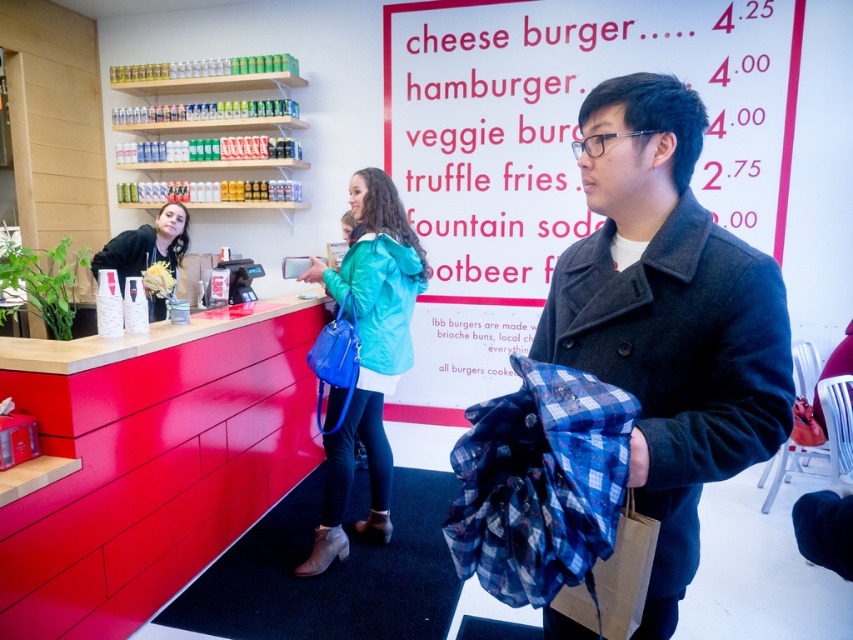
Locate an element on the screen. The image size is (853, 640). dark wool coat at center is located at coordinates (668, 317).

Does dark wool coat at center come in front of teal fabric jacket at center?

Yes, it is in front of teal fabric jacket at center.

Which is behind, point (601, 193) or point (383, 312)?

Positioned behind is point (383, 312).

Image resolution: width=853 pixels, height=640 pixels. What are the coordinates of `dark wool coat at center` in the screenshot? It's located at (668, 317).

Which is in front, point (753, 323) or point (120, 276)?

Point (753, 323) is in front.

Between dark wool coat at center and matte black hoodie at center, which one appears on the left side from the viewer's perspective?

From the viewer's perspective, matte black hoodie at center appears more on the left side.

Between point (567, 288) and point (125, 236), which one is positioned in front?

Point (567, 288)

Find the location of `dark wool coat at center`. dark wool coat at center is located at coordinates (668, 317).

Between teal fabric jacket at center and matte black hoodie at center, which one appears on the right side from the viewer's perspective?

From the viewer's perspective, teal fabric jacket at center appears more on the right side.

Is point (345, 547) positioned before point (131, 237)?

That is True.

This screenshot has width=853, height=640. In order to click on teal fabric jacket at center in this screenshot , I will do `click(367, 355)`.